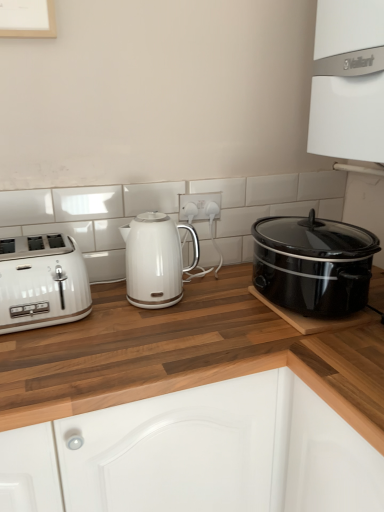
You are a GUI agent. You are given a task and a screenshot of the screen. Output one action in this format:
    pyautogui.click(x=<x>, y=<y>)
    Task: Click on the unoccupied region to the right of white glossy toaster at left
    
    Given the screenshot: What is the action you would take?
    pyautogui.click(x=113, y=316)